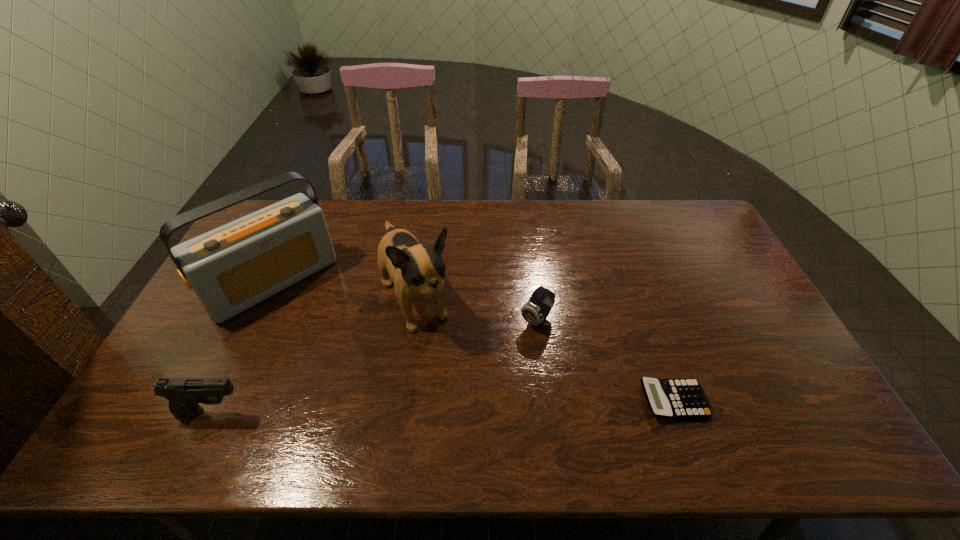
This screenshot has width=960, height=540. Identify the location of radio receiver that is at the left edge. coord(232,268).

You are a GUI agent. You are given a task and a screenshot of the screen. Output one action in this format:
    pyautogui.click(x=<x>, y=<y>)
    Task: Click on the object at the near left corner
    This screenshot has height=540, width=960.
    Given the screenshot: What is the action you would take?
    pyautogui.click(x=184, y=394)

This screenshot has width=960, height=540. In the image, there is a desktop. In order to click on vacant area at the far edge in this screenshot , I will do `click(389, 215)`.

The width and height of the screenshot is (960, 540). I want to click on vacant region at the near edge of the desktop, so click(632, 386).

Image resolution: width=960 pixels, height=540 pixels. I want to click on vacant area at the left edge, so click(218, 335).

The height and width of the screenshot is (540, 960). In the image, there is a desktop. What are the coordinates of `vacant area at the far right corner` in the screenshot? It's located at (698, 213).

In order to click on free spot between the radio receiver and the calculator in this screenshot , I will do `click(473, 341)`.

Locate an element on the screen. The image size is (960, 540). free spot between the pistol and the puppy is located at coordinates (312, 357).

Where is `free area in between the pistol and the rightmost object`? Image resolution: width=960 pixels, height=540 pixels. free area in between the pistol and the rightmost object is located at coordinates (443, 406).

Locate an element on the screen. This screenshot has height=540, width=960. free space between the third object from right to left and the radio receiver is located at coordinates (344, 292).